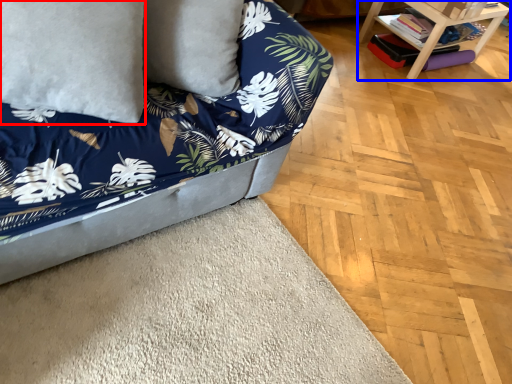
Question: Which point is further to the camera, pillow (highlighted by a red box) or table (highlighted by a blue box)?

Choices:
 (A) pillow
 (B) table

Answer: (B)